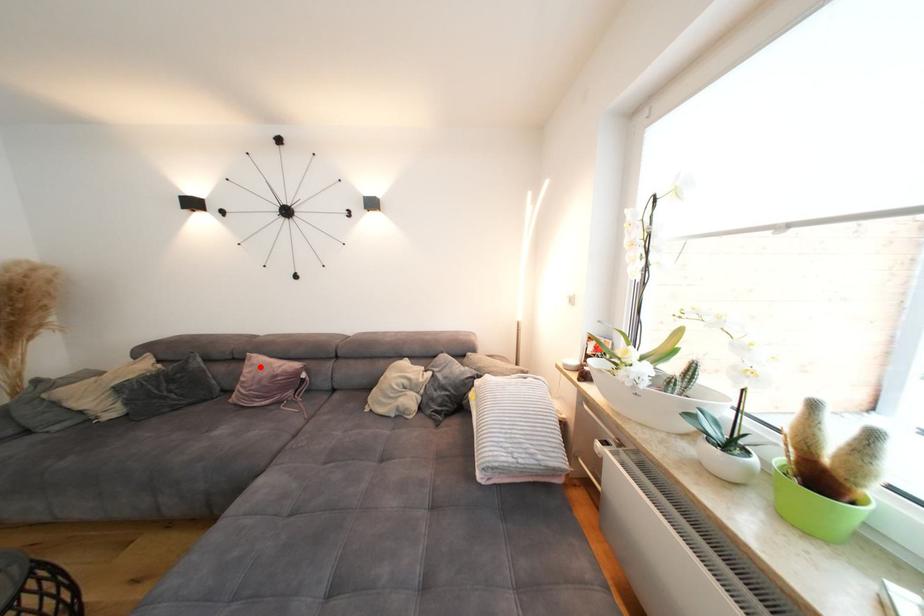
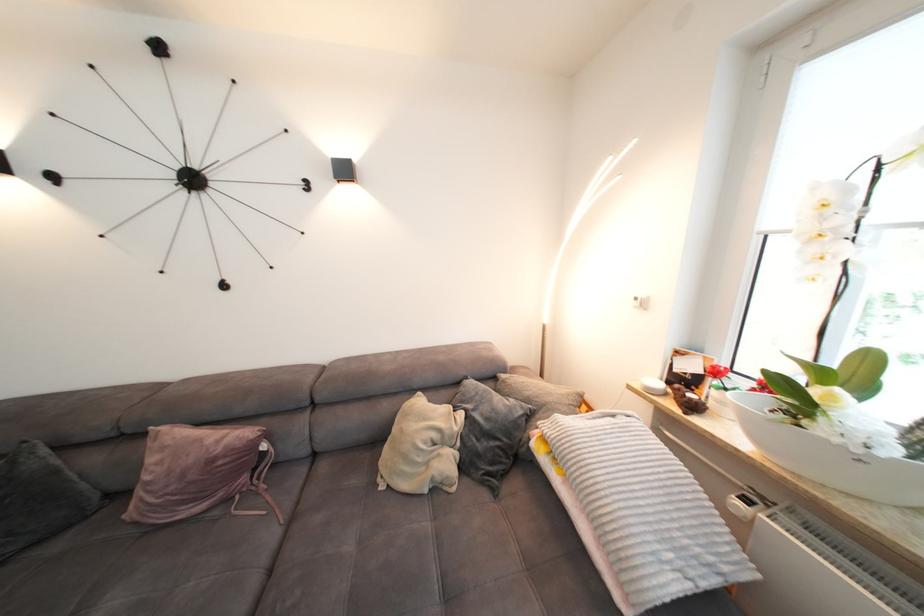
Locate, in the second image, the point that corresponds to the highlighted location in the first image.

(171, 448)